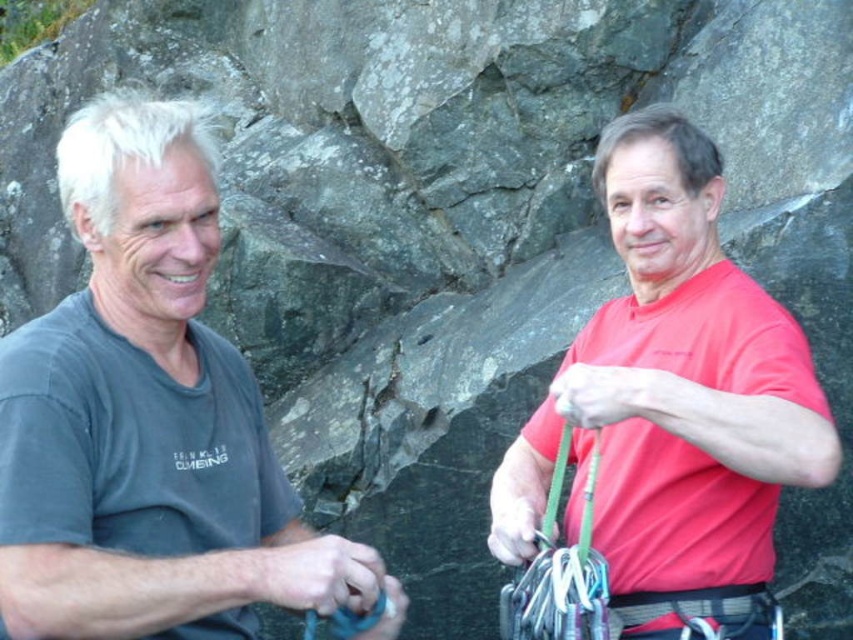
Does point (114, 394) come behind point (772, 412)?

Yes, it is.

At what (x,y) coordinates should I click in order to perform the action: click on dark gray t-shirt at left. Please return your answer as a coordinate pair (x, y). The width and height of the screenshot is (853, 640). Looking at the image, I should click on (x=149, y=420).

Locate an element on the screen. dark gray t-shirt at left is located at coordinates (149, 420).